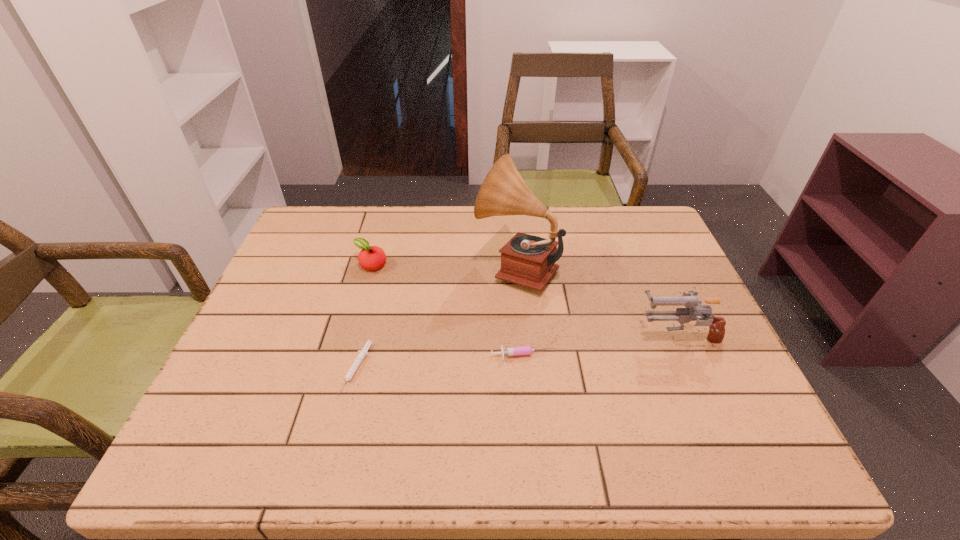
Where is `free location that satisfies the following two spatial constraints: 1. at the barrel end of the fourth shortest object; 2. on the front side of the shortest object`? free location that satisfies the following two spatial constraints: 1. at the barrel end of the fourth shortest object; 2. on the front side of the shortest object is located at coordinates (692, 369).

Image resolution: width=960 pixels, height=540 pixels. I want to click on vacant area in the image that satisfies the following two spatial constraints: 1. at the barrel end of the rightmost object; 2. on the front side of the second shortest object, so click(686, 356).